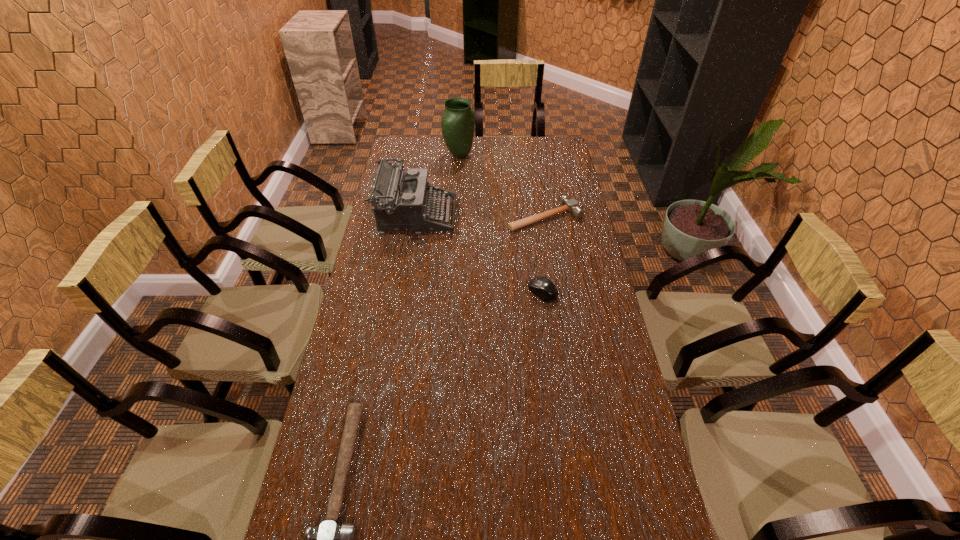
Identify the location of vacant area that lies between the fourth farthest object and the farthest object. (501, 224).

The height and width of the screenshot is (540, 960). I want to click on vacant point located between the right hammer and the mouse, so click(x=543, y=254).

Locate an element on the screen. This screenshot has height=540, width=960. the second closest object relative to the right hammer is located at coordinates (542, 287).

Identify which object is located as the nearest to the nearest object. Please provide its 2D coordinates. Your answer should be formatted as a tuple, i.e. [(x, y)], where the tuple contains the x and y coordinates of a point satisfying the conditions above.

[(542, 287)]

Identify the location of free point that satisfies the following two spatial constraints: 1. on the typing side of the fourth shortest object; 2. on the left side of the second nearest object. (404, 292).

Where is `blank space that satisfies the following two spatial constraints: 1. on the front side of the farther hammer; 2. on the typing side of the typewriter`? This screenshot has width=960, height=540. blank space that satisfies the following two spatial constraints: 1. on the front side of the farther hammer; 2. on the typing side of the typewriter is located at coordinates (545, 217).

Locate an element on the screen. The image size is (960, 540). free point that satisfies the following two spatial constraints: 1. on the typing side of the typewriter; 2. on the left side of the mouse is located at coordinates (404, 292).

This screenshot has width=960, height=540. What are the coordinates of `free location that satisfies the following two spatial constraints: 1. on the typing side of the second nearest object; 2. on the left side of the second tallest object` in the screenshot? It's located at (404, 292).